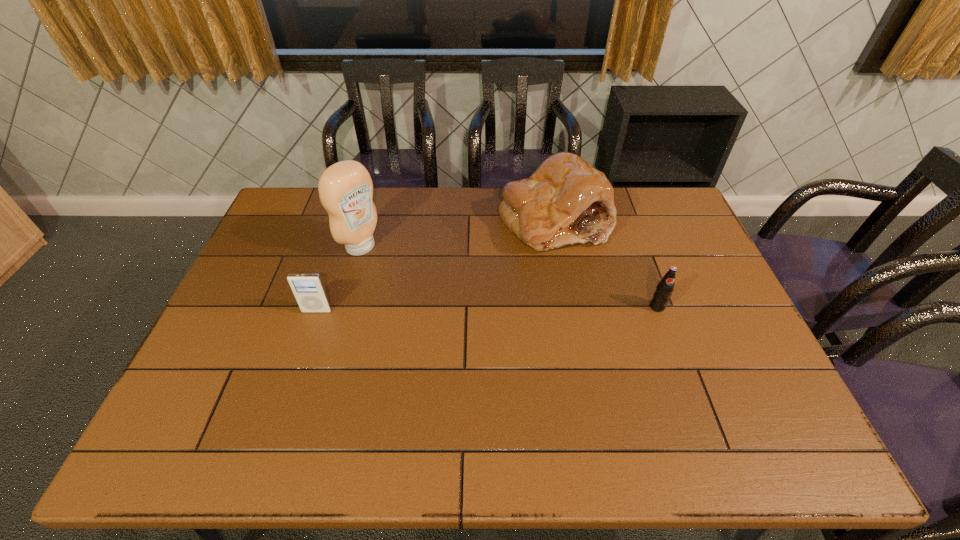
Locate an element on the screen. Image resolution: width=960 pixels, height=540 pixels. free area in between the bread and the iPod is located at coordinates click(x=435, y=266).

The height and width of the screenshot is (540, 960). Find the location of `free space between the pop and the iPod`. free space between the pop and the iPod is located at coordinates (487, 309).

Locate an element on the screen. Image resolution: width=960 pixels, height=540 pixels. free point between the second object from right to left and the iPod is located at coordinates click(x=435, y=266).

Identify the location of vacant area that lies between the second tallest object and the pop. The image size is (960, 540). (606, 264).

Locate an element on the screen. This screenshot has width=960, height=540. free area in between the pop and the third shortest object is located at coordinates (606, 264).

Where is `empty space between the bread and the iPod`? empty space between the bread and the iPod is located at coordinates (435, 266).

Where is `vacant area between the pop and the tallest object`? The height and width of the screenshot is (540, 960). vacant area between the pop and the tallest object is located at coordinates (509, 277).

Find the location of `empty location between the iPod and the tallest object`. empty location between the iPod and the tallest object is located at coordinates (339, 279).

You are a GUI agent. You are given a task and a screenshot of the screen. Output one action in this format:
    pyautogui.click(x=<x>, y=<y>)
    Task: Click on the free space between the third shortest object and the pop
    
    Given the screenshot: What is the action you would take?
    pyautogui.click(x=606, y=264)

This screenshot has width=960, height=540. Find the location of `vacant space that's between the rightmost object and the tallest object`. vacant space that's between the rightmost object and the tallest object is located at coordinates (509, 277).